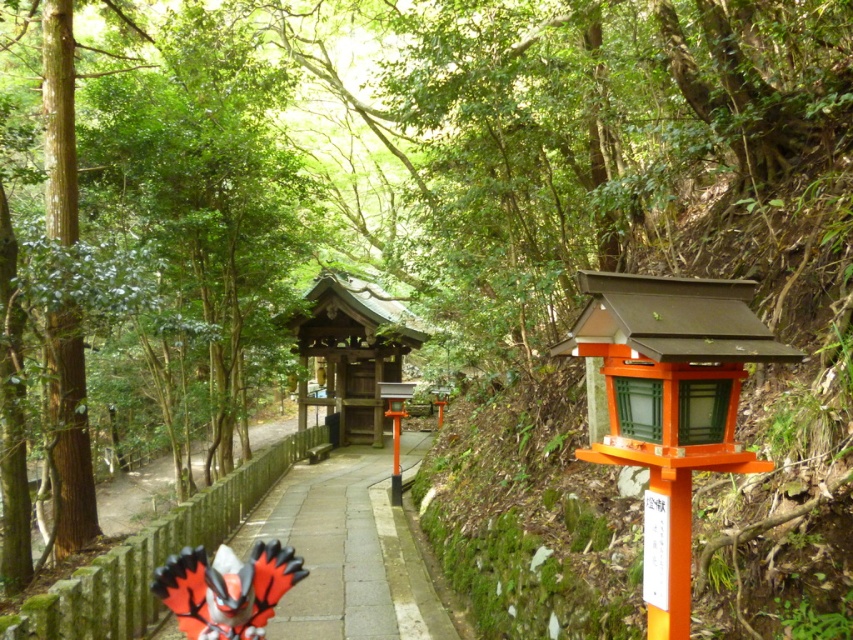
Who is more distant from viewer, (248, 529) or (231, 634)?

Positioned behind is point (248, 529).

Between point (357, 588) and point (236, 570), which one is positioned in front?

Point (236, 570) is in front.

Locate an element on the screen. The width and height of the screenshot is (853, 640). smooth stone path at center is located at coordinates (346, 554).

Find the location of `smooth stone path at center`. smooth stone path at center is located at coordinates (346, 554).